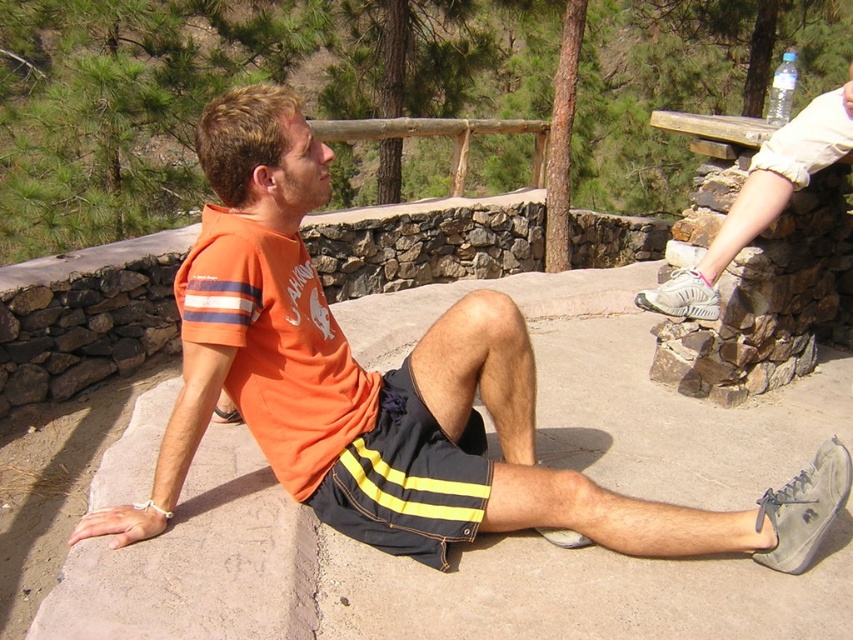
Between point (419, 524) and point (434, 476), which one is positioned in front?

Positioned in front is point (419, 524).

Which is behind, point (527, 358) or point (479, 490)?

Positioned behind is point (527, 358).

Where is `orange t-shirt at center`? The image size is (853, 640). orange t-shirt at center is located at coordinates (393, 392).

Does dark blue shorts with yellow stripes at center appear on the left side of white matte shoe at upper right?

Correct, you'll find dark blue shorts with yellow stripes at center to the left of white matte shoe at upper right.

Does dark blue shorts with yellow stripes at center appear over white matte shoe at upper right?

Actually, dark blue shorts with yellow stripes at center is below white matte shoe at upper right.

Who is more distant from viewer, (469,476) or (816,138)?

Point (816,138)

The image size is (853, 640). In order to click on dark blue shorts with yellow stripes at center in this screenshot , I will do `click(407, 477)`.

Can you confirm if orange t-shirt at center is thinner than white matte shoe at upper right?

Incorrect, orange t-shirt at center's width is not less than white matte shoe at upper right's.

Which is more to the left, orange t-shirt at center or white matte shoe at upper right?

orange t-shirt at center is more to the left.

What do you see at coordinates (393, 392) in the screenshot?
I see `orange t-shirt at center` at bounding box center [393, 392].

You are a GUI agent. You are given a task and a screenshot of the screen. Output one action in this format:
    pyautogui.click(x=<x>, y=<y>)
    Task: Click on the orange t-shirt at center
    The height and width of the screenshot is (640, 853).
    Given the screenshot: What is the action you would take?
    pyautogui.click(x=393, y=392)